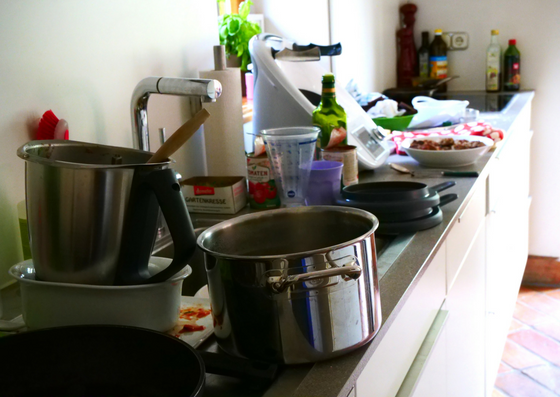
The height and width of the screenshot is (397, 560). I want to click on bowl, so click(x=459, y=155).